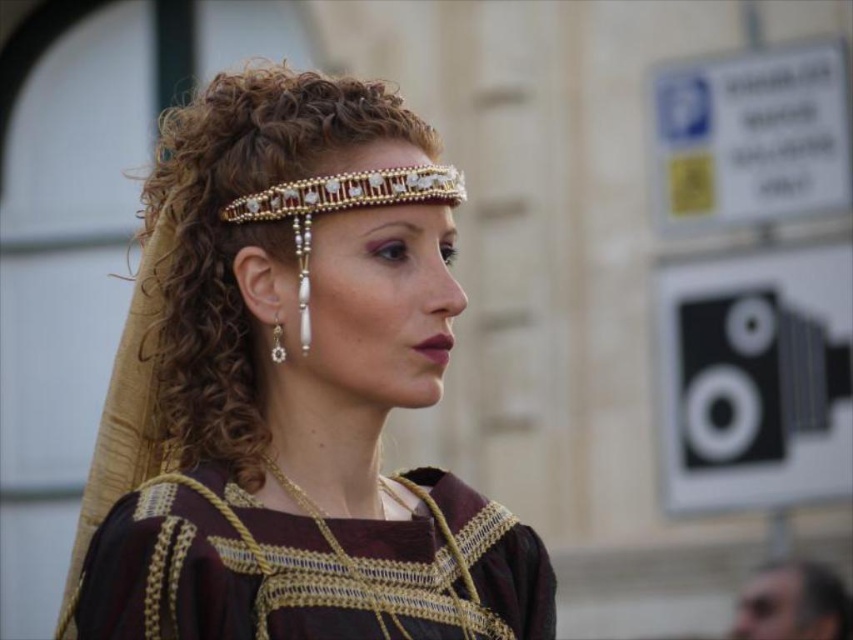
Question: Can you confirm if burgundy fabric dress at center is positioned above gold beaded tiara at upper center?

Choices:
 (A) yes
 (B) no

Answer: (B)

Question: Can you confirm if matte gold headband at center is thinner than smooth brown hair at lower right?

Choices:
 (A) no
 (B) yes

Answer: (A)

Question: Which point is closer to the camera?

Choices:
 (A) (276, 321)
 (B) (88, 628)
 (C) (303, 188)
 (D) (778, 627)

Answer: (B)

Question: Where is matte gold headband at center located in relation to smooth brown hair at lower right in the image?

Choices:
 (A) right
 (B) left

Answer: (B)

Question: Which of the following is the closest to the observer?

Choices:
 (A) matte gold headband at center
 (B) smooth brown hair at lower right
 (C) gold beaded tiara at upper center
 (D) burgundy fabric dress at center

Answer: (D)

Question: Which of the following is the farthest from the observer?

Choices:
 (A) matte gold headband at center
 (B) gold beaded tiara at upper center
 (C) smooth brown hair at lower right
 (D) pearl/stone earrings at left

Answer: (C)